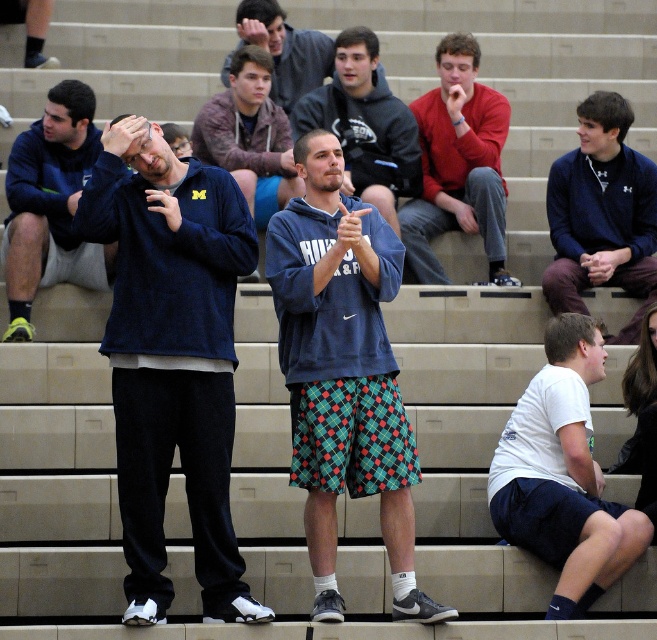
Can you confirm if blue fleece jacket at upper right is bigger than red fleece sweatshirt at center?

Indeed, blue fleece jacket at upper right has a larger size compared to red fleece sweatshirt at center.

What do you see at coordinates (600, 212) in the screenshot? I see `blue fleece jacket at upper right` at bounding box center [600, 212].

Is point (547, 282) farther from camera compared to point (470, 173)?

No, it is not.

Where is `blue fleece jacket at upper right`? The width and height of the screenshot is (657, 640). blue fleece jacket at upper right is located at coordinates (600, 212).

Which is behind, point (313, 404) or point (507, 460)?

The point (507, 460) is behind.

Does blue fleece hoodie at center appear on the right side of white cotton shirt at lower right?

In fact, blue fleece hoodie at center is to the left of white cotton shirt at lower right.

Between point (409, 556) and point (574, 573), which one is positioned in front?

Point (574, 573)

Find the location of `blue fleece hoodie at center`. blue fleece hoodie at center is located at coordinates (344, 372).

Does dark blue fleece sweatshirt at left have a larger size compared to plaid shorts at center?

Incorrect, dark blue fleece sweatshirt at left is not larger than plaid shorts at center.

Who is positioned more to the right, dark blue fleece sweatshirt at left or plaid shorts at center?

plaid shorts at center is more to the right.

Between point (221, 310) and point (279, 100), which one is positioned behind?

The point (279, 100) is behind.

The image size is (657, 640). In order to click on dark blue fleece sweatshirt at left in this screenshot , I will do `click(171, 356)`.